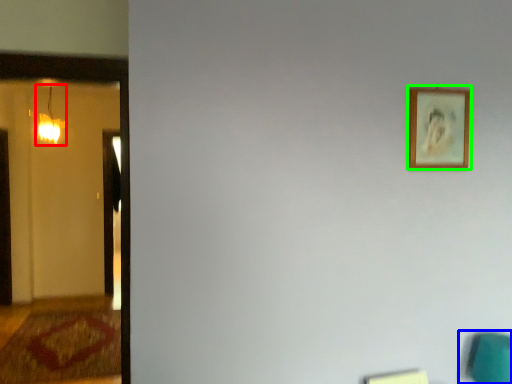
Question: Which object is the farthest from lamp (highlighted by a red box)? Choose among these: swivel chair (highlighted by a blue box) or picture frame (highlighted by a green box).

Choices:
 (A) swivel chair
 (B) picture frame

Answer: (A)